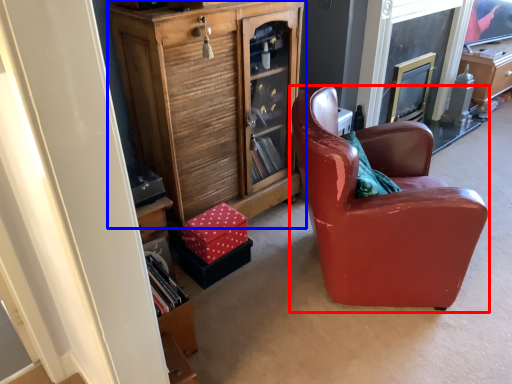
Question: Which of the following is the farthest to the observer, chair (highlighted by a red box) or cabinetry (highlighted by a blue box)?

Choices:
 (A) chair
 (B) cabinetry

Answer: (B)